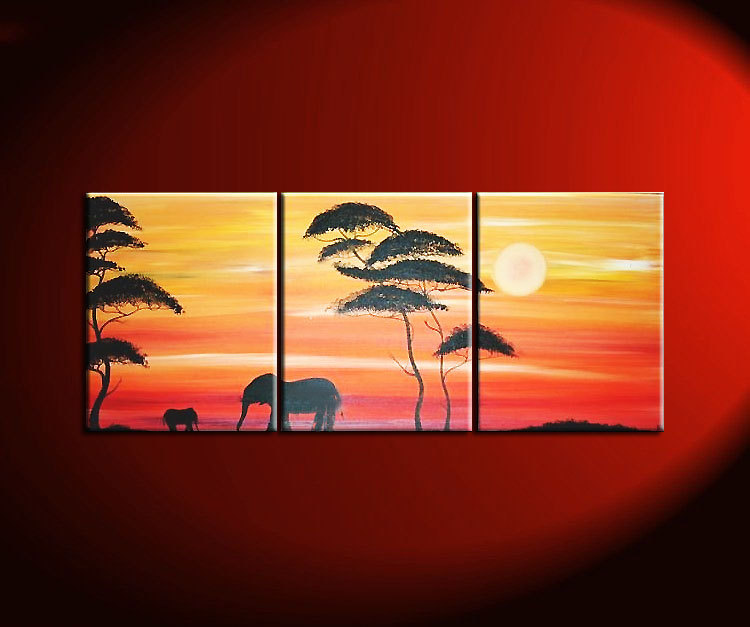
Identify the location of red wall. The image size is (750, 627). (532, 113).